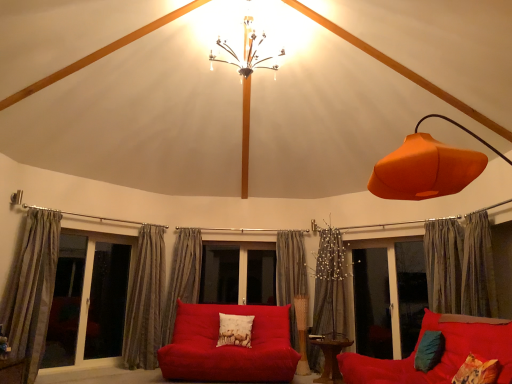
Question: Is silky gray curtain at right, arranged as the 6th curtain when viewed from the left, to the left of matte glass window at left from the viewer's perspective?

Choices:
 (A) no
 (B) yes

Answer: (A)

Question: From the image's perspective, would you say silky gray curtain at right, arranged as the 6th curtain when viewed from the left, is positioned over matte glass window at left?

Choices:
 (A) yes
 (B) no

Answer: (A)

Question: Considering the relative sizes of silky gray curtain at right, which appears as the first curtain when viewed from the right, and matte glass window at left in the image provided, is silky gray curtain at right, which appears as the first curtain when viewed from the right, shorter than matte glass window at left?

Choices:
 (A) yes
 (B) no

Answer: (A)

Question: Does silky gray curtain at right, which appears as the first curtain when viewed from the right, have a greater height compared to matte glass window at left?

Choices:
 (A) no
 (B) yes

Answer: (A)

Question: From a real-world perspective, is silky gray curtain at right, arranged as the 6th curtain when viewed from the left, positioned under matte glass window at left based on gravity?

Choices:
 (A) yes
 (B) no

Answer: (B)

Question: Looking at the image, does printed fabric pillow at center, the third pillow in the back-to-front sequence, seem bigger or smaller compared to matte glass window at left?

Choices:
 (A) big
 (B) small

Answer: (B)

Question: Considering the positions of point (476, 380) and point (104, 350), is point (476, 380) closer or farther from the camera than point (104, 350)?

Choices:
 (A) farther
 (B) closer

Answer: (B)

Question: Is printed fabric pillow at center, which is the 1th pillow from front to back, in front of or behind matte glass window at left in the image?

Choices:
 (A) behind
 (B) front

Answer: (B)

Question: From a real-world perspective, is printed fabric pillow at center, acting as the first pillow starting from the right, above or below matte glass window at left?

Choices:
 (A) above
 (B) below

Answer: (B)

Question: From a real-world perspective, is white cotton pillow with animal print at center, which is counted as the first pillow, starting from the back, physically located above or below white glass screen door at left, the second screen door from the right?

Choices:
 (A) below
 (B) above

Answer: (A)

Question: Is white cotton pillow with animal print at center, which is the 3th pillow in right-to-left order, to the left or to the right of white glass screen door at left, the second screen door from the right, in the image?

Choices:
 (A) right
 (B) left

Answer: (A)

Question: Considering the positions of white cotton pillow with animal print at center, which is counted as the first pillow, starting from the back, and white glass screen door at left, which appears as the first screen door when viewed from the left, in the image, is white cotton pillow with animal print at center, which is counted as the first pillow, starting from the back, wider or thinner than white glass screen door at left, which appears as the first screen door when viewed from the left,?

Choices:
 (A) wide
 (B) thin

Answer: (A)

Question: Looking at the image, does white cotton pillow with animal print at center, which is the 3th pillow in right-to-left order, seem bigger or smaller compared to white glass screen door at left, which appears as the first screen door when viewed from the left?

Choices:
 (A) small
 (B) big

Answer: (A)

Question: Is white glass screen door at left, the second screen door from the right, wider or thinner than wooden table at center?

Choices:
 (A) thin
 (B) wide

Answer: (A)

Question: Considering the positions of point (105, 322) and point (325, 344), is point (105, 322) closer or farther from the camera than point (325, 344)?

Choices:
 (A) farther
 (B) closer

Answer: (A)